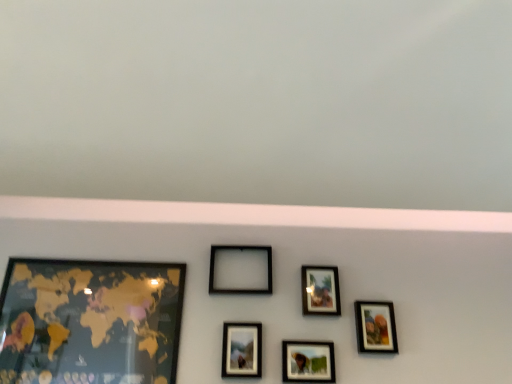
What do you see at coordinates (242, 350) in the screenshot?
I see `matte glass photo frame at center, which is counted as the 3th picture frame, starting from the left` at bounding box center [242, 350].

What do you see at coordinates (90, 322) in the screenshot? This screenshot has height=384, width=512. I see `gold matte map at left, arranged as the 1th picture frame when viewed from the left` at bounding box center [90, 322].

You are a GUI agent. You are given a task and a screenshot of the screen. Output one action in this format:
    pyautogui.click(x=<x>, y=<y>)
    Task: Click on the matte black picture frame at lower right, which ranks as the 6th picture frame in left-to-right order
    Image resolution: width=512 pixels, height=384 pixels.
    Given the screenshot: What is the action you would take?
    pyautogui.click(x=375, y=327)

The height and width of the screenshot is (384, 512). What do you see at coordinates (375, 327) in the screenshot?
I see `matte black picture frame at lower right, which ranks as the 6th picture frame in left-to-right order` at bounding box center [375, 327].

The image size is (512, 384). Find the location of `matte glass photo frame at center, which is counted as the 3th picture frame, starting from the left`. matte glass photo frame at center, which is counted as the 3th picture frame, starting from the left is located at coordinates (242, 350).

From a real-world perspective, starting from the black matte picture frame at center, positioned as the 5th picture frame in right-to-left order, which picture frame is the 5th one below it? Please provide its 2D coordinates.

[(308, 362)]

Which of these two, matte black picture frame at center, which appears as the third picture frame when viewed from the right, or black matte picture frame at center, which is the 2th picture frame from left to right, is bigger?

black matte picture frame at center, which is the 2th picture frame from left to right, is bigger.

Is matte black picture frame at center, which appears as the third picture frame when viewed from the right, looking in the opposite direction of black matte picture frame at center, which is the 2th picture frame from left to right?

No, matte black picture frame at center, which appears as the third picture frame when viewed from the right, is not facing the opposite direction of black matte picture frame at center, which is the 2th picture frame from left to right.

Does matte black picture frame at center, placed as the fourth picture frame when sorted from left to right, have a greater width compared to black matte picture frame at center, positioned as the 5th picture frame in right-to-left order?

Correct, the width of matte black picture frame at center, placed as the fourth picture frame when sorted from left to right, exceeds that of black matte picture frame at center, positioned as the 5th picture frame in right-to-left order.

You are a GUI agent. You are given a task and a screenshot of the screen. Output one action in this format:
    pyautogui.click(x=<x>, y=<y>)
    Task: Click on the picture frame that is the 3rd one when counting downward from the gold matte map at left, which appears as the sixth picture frame when viewed from the right (from the image's perspective)
    Image resolution: width=512 pixels, height=384 pixels.
    Given the screenshot: What is the action you would take?
    pyautogui.click(x=308, y=362)

Is matte black picture frame at center, placed as the fourth picture frame when sorted from left to right, smaller than gold matte map at left, arranged as the 1th picture frame when viewed from the left?

Correct, matte black picture frame at center, placed as the fourth picture frame when sorted from left to right, occupies less space than gold matte map at left, arranged as the 1th picture frame when viewed from the left.

From the image's perspective, who appears lower, matte black picture frame at center, placed as the fourth picture frame when sorted from left to right, or gold matte map at left, arranged as the 1th picture frame when viewed from the left?

matte black picture frame at center, placed as the fourth picture frame when sorted from left to right, from the image's perspective.

Is there a large distance between matte glass photo frame at center, which is counted as the 3th picture frame, starting from the left, and gold matte map at left, which appears as the sixth picture frame when viewed from the right?

matte glass photo frame at center, which is counted as the 3th picture frame, starting from the left, is actually quite close to gold matte map at left, which appears as the sixth picture frame when viewed from the right.

From a real-world perspective, is matte glass photo frame at center, which is counted as the 3th picture frame, starting from the left, positioned over gold matte map at left, arranged as the 1th picture frame when viewed from the left, based on gravity?

No, from a real-world perspective, matte glass photo frame at center, which is counted as the 3th picture frame, starting from the left, is not on top of gold matte map at left, arranged as the 1th picture frame when viewed from the left.

Is matte glass photo frame at center, which is counted as the 3th picture frame, starting from the left, facing away from gold matte map at left, which appears as the sixth picture frame when viewed from the right?

That's not correct — matte glass photo frame at center, which is counted as the 3th picture frame, starting from the left, is not looking away from gold matte map at left, which appears as the sixth picture frame when viewed from the right.

The width and height of the screenshot is (512, 384). Find the location of `the 2nd picture frame above the matte glass photo frame at center, which appears as the fourth picture frame when viewed from the right (from the image's perspective)`. the 2nd picture frame above the matte glass photo frame at center, which appears as the fourth picture frame when viewed from the right (from the image's perspective) is located at coordinates (90, 322).

Is matte black picture frame at lower right, the 1th picture frame from the right, touching matte glass photo frame at center, which appears as the fourth picture frame when viewed from the right?

There is a gap between matte black picture frame at lower right, the 1th picture frame from the right, and matte glass photo frame at center, which appears as the fourth picture frame when viewed from the right.

From a real-world perspective, starting from the matte glass photo frame at center, which appears as the fourth picture frame when viewed from the right, which picture frame is the 1st one vertically above it? Please provide its 2D coordinates.

[(375, 327)]

From the image's perspective, is matte black picture frame at lower right, the 1th picture frame from the right, below matte glass photo frame at center, which is counted as the 3th picture frame, starting from the left?

No, from the image's perspective, matte black picture frame at lower right, the 1th picture frame from the right, is not beneath matte glass photo frame at center, which is counted as the 3th picture frame, starting from the left.

Is matte black picture frame at lower right, the 1th picture frame from the right, shorter than matte glass photo frame at center, which is counted as the 3th picture frame, starting from the left?

No, matte black picture frame at lower right, the 1th picture frame from the right, is not shorter than matte glass photo frame at center, which is counted as the 3th picture frame, starting from the left.

Between point (234, 368) and point (379, 344), which one is positioned behind?

The point (379, 344) is farther.

Which of these two, matte glass photo frame at center, which appears as the fourth picture frame when viewed from the right, or matte black picture frame at lower right, which ranks as the 6th picture frame in left-to-right order, stands shorter?

With less height is matte glass photo frame at center, which appears as the fourth picture frame when viewed from the right.

Considering the sizes of objects matte glass photo frame at center, which is counted as the 3th picture frame, starting from the left, and matte black picture frame at lower right, the 1th picture frame from the right, in the image provided, who is bigger, matte glass photo frame at center, which is counted as the 3th picture frame, starting from the left, or matte black picture frame at lower right, the 1th picture frame from the right,?

matte glass photo frame at center, which is counted as the 3th picture frame, starting from the left.

I want to click on picture frame that is the 2nd one when counting backward from the matte glass photo frame at center, which is counted as the 3th picture frame, starting from the left, so [x=375, y=327].

Locate an element on the screen. The image size is (512, 384). the 2nd picture frame behind the matte black picture frame at center, which appears as the third picture frame when viewed from the right, starting your count from the anchor is located at coordinates (320, 290).

Does matte black picture frame at upper center, the fifth picture frame viewed from the left, have a larger size compared to matte black picture frame at center, which appears as the third picture frame when viewed from the right?

No, matte black picture frame at upper center, the fifth picture frame viewed from the left, is not bigger than matte black picture frame at center, which appears as the third picture frame when viewed from the right.

Is matte black picture frame at upper center, the fifth picture frame viewed from the left, wider than matte black picture frame at center, which appears as the third picture frame when viewed from the right?

In fact, matte black picture frame at upper center, the fifth picture frame viewed from the left, might be narrower than matte black picture frame at center, which appears as the third picture frame when viewed from the right.

Can you confirm if matte black picture frame at upper center, the 2th picture frame from the right, is taller than matte black picture frame at center, which appears as the third picture frame when viewed from the right?

Indeed, matte black picture frame at upper center, the 2th picture frame from the right, has a greater height compared to matte black picture frame at center, which appears as the third picture frame when viewed from the right.

Does matte black picture frame at upper center, the fifth picture frame viewed from the left, have a larger size compared to gold matte map at left, which appears as the sixth picture frame when viewed from the right?

No.

From the image's perspective, starting from the matte black picture frame at upper center, the fifth picture frame viewed from the left, which picture frame is the 1st one below? Please provide its 2D coordinates.

[(90, 322)]

Is gold matte map at left, which appears as the sixth picture frame when viewed from the right, a part of matte black picture frame at upper center, the 2th picture frame from the right?

No, gold matte map at left, which appears as the sixth picture frame when viewed from the right, is not surrounded by matte black picture frame at upper center, the 2th picture frame from the right.

Does matte black picture frame at upper center, the 2th picture frame from the right, turn towards gold matte map at left, arranged as the 1th picture frame when viewed from the left?

No, matte black picture frame at upper center, the 2th picture frame from the right, is not turned towards gold matte map at left, arranged as the 1th picture frame when viewed from the left.

There is a black matte picture frame at center, positioned as the 5th picture frame in right-to-left order. Identify the location of the 5th picture frame below it (from a real-world perspective). This screenshot has height=384, width=512. (308, 362).

There is a matte black picture frame at center, which appears as the third picture frame when viewed from the right. Find the location of `the 3rd picture frame above it (from the image's perspective)`. the 3rd picture frame above it (from the image's perspective) is located at coordinates (90, 322).

When comparing their distances from gold matte map at left, arranged as the 1th picture frame when viewed from the left, does matte black picture frame at upper center, the 2th picture frame from the right, or black matte picture frame at center, which is the 2th picture frame from left to right, seem closer?

black matte picture frame at center, which is the 2th picture frame from left to right, lies closer to gold matte map at left, arranged as the 1th picture frame when viewed from the left, than the other object.

Based on their spatial positions, is matte black picture frame at upper center, the fifth picture frame viewed from the left, or matte black picture frame at center, which appears as the third picture frame when viewed from the right, further from gold matte map at left, which appears as the sixth picture frame when viewed from the right?

matte black picture frame at upper center, the fifth picture frame viewed from the left, is positioned further to the anchor gold matte map at left, which appears as the sixth picture frame when viewed from the right.

Based on their spatial positions, is gold matte map at left, which appears as the sixth picture frame when viewed from the right, or matte black picture frame at upper center, the 2th picture frame from the right, closer to black matte picture frame at center, positioned as the 5th picture frame in right-to-left order?

matte black picture frame at upper center, the 2th picture frame from the right, lies closer to black matte picture frame at center, positioned as the 5th picture frame in right-to-left order, than the other object.

Which object lies nearer to the anchor point black matte picture frame at center, positioned as the 5th picture frame in right-to-left order, gold matte map at left, arranged as the 1th picture frame when viewed from the left, or matte glass photo frame at center, which is counted as the 3th picture frame, starting from the left?

Among the two, matte glass photo frame at center, which is counted as the 3th picture frame, starting from the left, is located nearer to black matte picture frame at center, positioned as the 5th picture frame in right-to-left order.

When comparing their distances from matte black picture frame at center, placed as the fourth picture frame when sorted from left to right, does matte black picture frame at upper center, the 2th picture frame from the right, or matte black picture frame at lower right, which ranks as the 6th picture frame in left-to-right order, seem further?

matte black picture frame at lower right, which ranks as the 6th picture frame in left-to-right order.

Estimate the real-world distances between objects in this image. Which object is closer to gold matte map at left, which appears as the sixth picture frame when viewed from the right, matte glass photo frame at center, which appears as the fourth picture frame when viewed from the right, or black matte picture frame at center, which is the 2th picture frame from left to right?

black matte picture frame at center, which is the 2th picture frame from left to right, is closer to gold matte map at left, which appears as the sixth picture frame when viewed from the right.

Which object lies nearer to the anchor point matte black picture frame at upper center, the fifth picture frame viewed from the left, matte black picture frame at lower right, the 1th picture frame from the right, or matte glass photo frame at center, which appears as the fourth picture frame when viewed from the right?

The object closer to matte black picture frame at upper center, the fifth picture frame viewed from the left, is matte black picture frame at lower right, the 1th picture frame from the right.

Which object lies nearer to the anchor point matte glass photo frame at center, which is counted as the 3th picture frame, starting from the left, black matte picture frame at center, which is the 2th picture frame from left to right, or matte black picture frame at center, placed as the fourth picture frame when sorted from left to right?

matte black picture frame at center, placed as the fourth picture frame when sorted from left to right.

The image size is (512, 384). I want to click on picture frame located between matte glass photo frame at center, which is counted as the 3th picture frame, starting from the left, and matte black picture frame at upper center, the 2th picture frame from the right, in the left-right direction, so click(308, 362).

Find the location of `picture frame between matte black picture frame at center, placed as the fourth picture frame when sorted from left to right, and matte black picture frame at lower right, the 1th picture frame from the right, from left to right`. picture frame between matte black picture frame at center, placed as the fourth picture frame when sorted from left to right, and matte black picture frame at lower right, the 1th picture frame from the right, from left to right is located at coordinates click(320, 290).

The image size is (512, 384). Identify the location of picture frame between gold matte map at left, arranged as the 1th picture frame when viewed from the left, and matte glass photo frame at center, which is counted as the 3th picture frame, starting from the left. (240, 269).